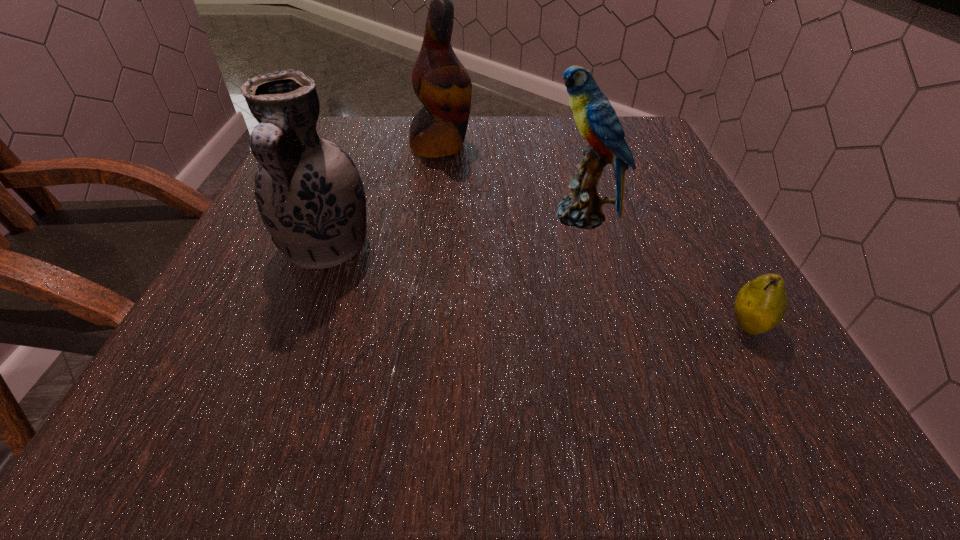
Locate an element on the screen. This screenshot has height=540, width=960. the second object from left to right is located at coordinates (440, 81).

At what (x,y) coordinates should I click in order to perform the action: click on the left parrot. Please return your answer as a coordinate pair (x, y). The image size is (960, 540). Looking at the image, I should click on (440, 81).

This screenshot has height=540, width=960. Find the location of `the leftmost object`. the leftmost object is located at coordinates (309, 193).

Find the location of a particular element. the shorter parrot is located at coordinates (596, 119).

The image size is (960, 540). What are the coordinates of `the third object from left to right` in the screenshot? It's located at (596, 119).

I want to click on the rightmost object, so click(761, 304).

Locate an element on the screen. the nearest object is located at coordinates (761, 304).

You are a GUI agent. You are given a task and a screenshot of the screen. Output one action in this format:
    pyautogui.click(x=<x>, y=<y>)
    Task: Click on the vacant space located 0.100m on the face of the farther parrot
    The height and width of the screenshot is (540, 960).
    Given the screenshot: What is the action you would take?
    pyautogui.click(x=516, y=146)

This screenshot has width=960, height=540. I want to click on free space located with the handle on the side of the vase, so click(285, 354).

Identify the location of vacant space positioned 0.280m on the face of the right parrot. This screenshot has height=540, width=960. (395, 216).